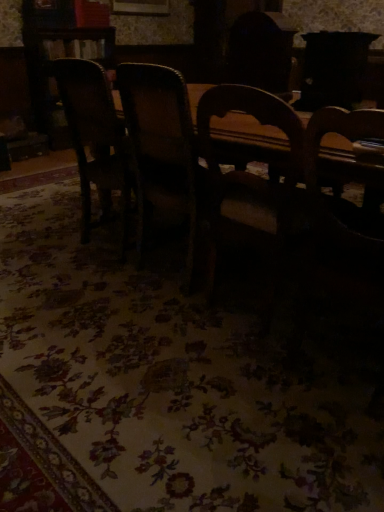
Question: Does wooden chair at center, the first chair viewed from the right, have a larger size compared to wooden chair at left, acting as the second chair starting from the right?

Choices:
 (A) no
 (B) yes

Answer: (B)

Question: Can you confirm if wooden chair at center, which ranks as the second chair in left-to-right order, is positioned to the left of wooden chair at left, marked as the first chair in a left-to-right arrangement?

Choices:
 (A) yes
 (B) no

Answer: (B)

Question: From the image's perspective, does wooden chair at center, which ranks as the second chair in left-to-right order, appear lower than wooden chair at left, marked as the first chair in a left-to-right arrangement?

Choices:
 (A) no
 (B) yes

Answer: (B)

Question: Is wooden chair at center, which ranks as the second chair in left-to-right order, not inside wooden chair at left, marked as the first chair in a left-to-right arrangement?

Choices:
 (A) yes
 (B) no

Answer: (A)

Question: Can you confirm if wooden chair at center, the first chair viewed from the right, is wider than wooden chair at left, marked as the first chair in a left-to-right arrangement?

Choices:
 (A) yes
 (B) no

Answer: (A)

Question: From a real-world perspective, is wooden chair at center, which ranks as the second chair in left-to-right order, physically below wooden chair at left, acting as the second chair starting from the right?

Choices:
 (A) yes
 (B) no

Answer: (B)

Question: Does wooden chair at left, acting as the second chair starting from the right, have a lesser height compared to wooden chair at center, which ranks as the second chair in left-to-right order?

Choices:
 (A) yes
 (B) no

Answer: (A)

Question: From the image's perspective, is wooden chair at left, acting as the second chair starting from the right, beneath wooden chair at center, the first chair viewed from the right?

Choices:
 (A) no
 (B) yes

Answer: (A)

Question: Can you confirm if wooden chair at left, acting as the second chair starting from the right, is positioned to the left of wooden chair at center, the first chair viewed from the right?

Choices:
 (A) yes
 (B) no

Answer: (A)

Question: Does wooden chair at left, acting as the second chair starting from the right, have a lesser width compared to wooden chair at center, which ranks as the second chair in left-to-right order?

Choices:
 (A) no
 (B) yes

Answer: (B)

Question: Is wooden chair at left, marked as the first chair in a left-to-right arrangement, not near wooden chair at center, the first chair viewed from the right?

Choices:
 (A) yes
 (B) no

Answer: (B)

Question: Is wooden chair at left, acting as the second chair starting from the right, beside wooden chair at center, the first chair viewed from the right?

Choices:
 (A) no
 (B) yes

Answer: (A)

Question: Do you think wooden chair at center, the first chair viewed from the right, is within wooden chair at left, marked as the first chair in a left-to-right arrangement, or outside of it?

Choices:
 (A) inside
 (B) outside

Answer: (B)